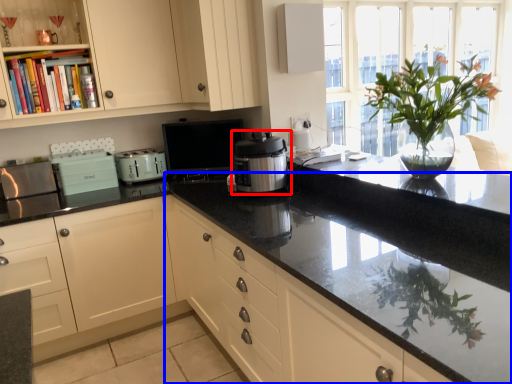
Question: Among these objects, which one is nearest to the camera, home appliance (highlighted by a red box) or countertop (highlighted by a blue box)?

Choices:
 (A) home appliance
 (B) countertop

Answer: (B)